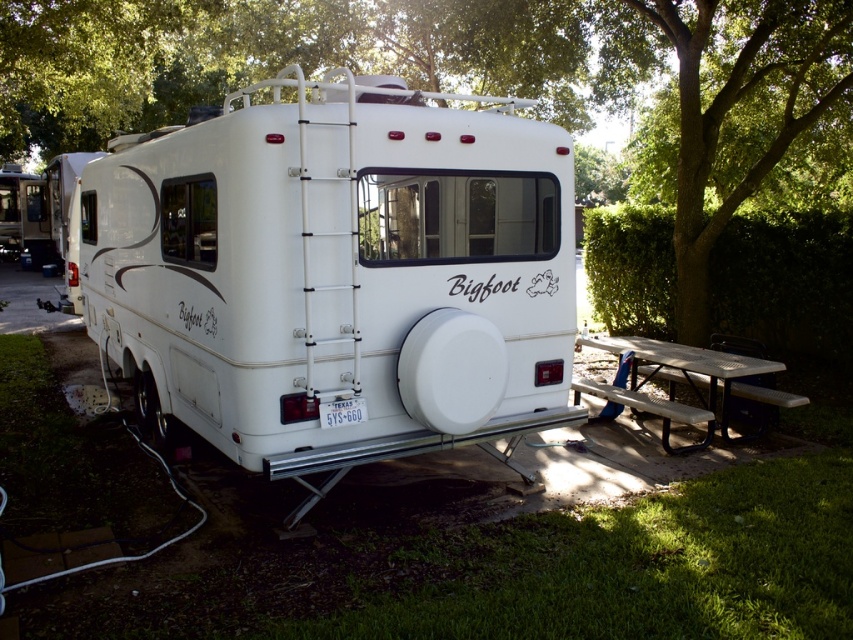
You are standing at the picnic area and want to place a heavy camping gear on the picnic table. The gear weighs 50 kg. Is the white plastic picnic table at lower right capable of supporting the weight of the camping gear based on its position relative to the white matte recreational vehicle at center?

The white plastic picnic table at lower right is positioned below the white matte recreational vehicle at center. Since the picnic table is under the RV, it might not be designed to handle heavy loads like 50 kg camping gear. It is advisable to place lighter items on the picnic table.

You are planning to set up a tent in the campsite. The green leafy tree at upper center and the white plastic picnic table at lower right are in your way. Which object do you need to move to make more space?

The green leafy tree at upper center has a larger width than the white plastic picnic table at lower right, so you should move the green leafy tree at upper center to create more space.